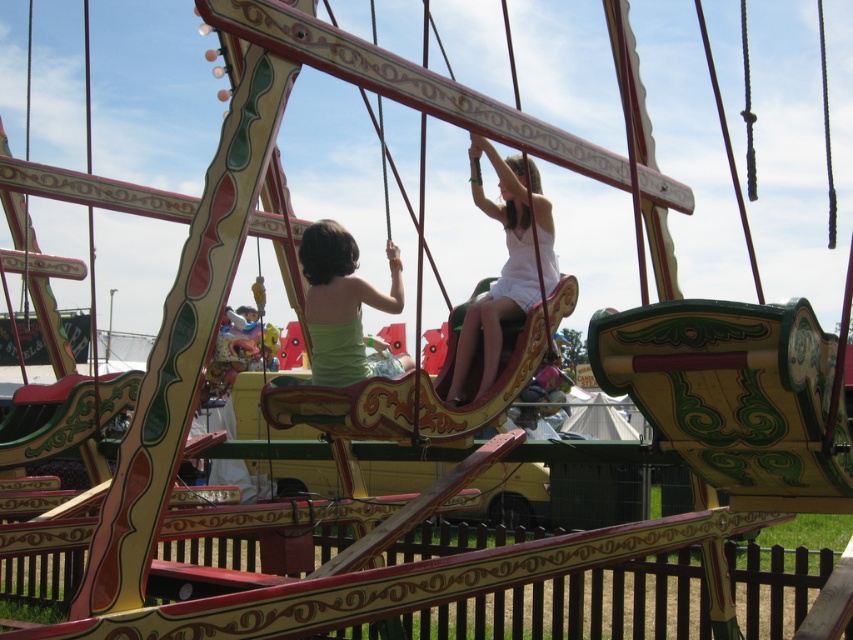
You are standing in front of the carousel at the fairground. You see the white matte dress at upper center and the green matte tank top at center. Which clothing item is closer to you?

The white matte dress at upper center is closer to you because it is further to the viewer than the green matte tank top at center.

Consider the image. You are a photographer standing at the entrance of the carousel. You need to capture both the white matte dress at upper center and the green matte tank top at center in a single photo. Which object should be placed closer to the camera to ensure both are fully visible?

The white matte dress at upper center is much taller than the green matte tank top at center. To ensure both are fully visible in the photo, the taller object, the white matte dress at upper center, should be placed closer to the camera. This way, the height difference will be minimized, allowing both subjects to fit within the frame appropriately.

Consider the image. What is the exact location of the white matte dress at upper center in the image?

The white matte dress at upper center is located at point coordinates of (505, 262).